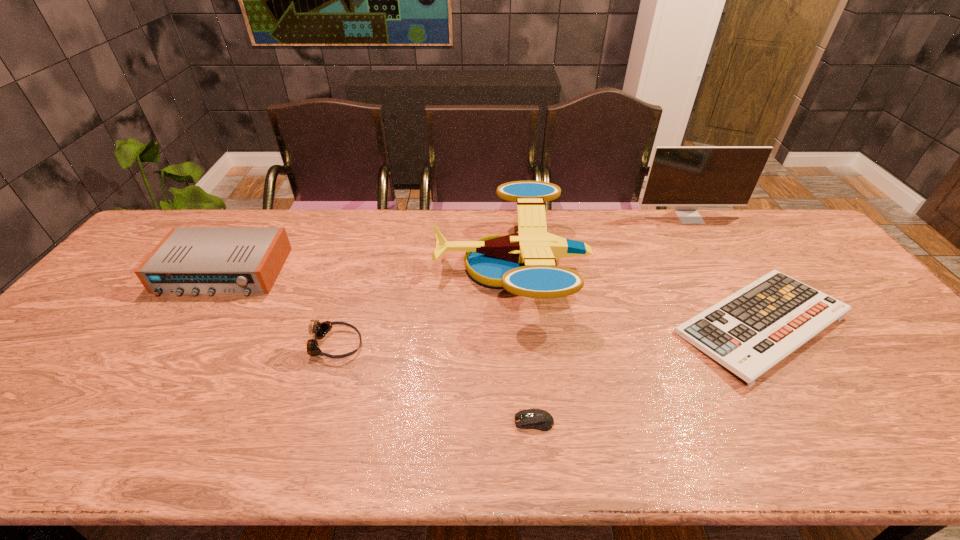
I want to click on monitor, so click(x=686, y=177).

Where is `the fifth shortest object`? This screenshot has height=540, width=960. the fifth shortest object is located at coordinates [x=524, y=263].

This screenshot has height=540, width=960. In order to click on the third tallest object in this screenshot , I will do `click(189, 260)`.

Locate an element on the screen. radio receiver is located at coordinates [x=189, y=260].

Locate an element on the screen. The image size is (960, 540). the third shortest object is located at coordinates (319, 330).

Find the location of a particular element. Image resolution: width=960 pixels, height=540 pixels. goggles is located at coordinates (319, 330).

You are a GUI agent. You are given a task and a screenshot of the screen. Output one action in this format:
    pyautogui.click(x=<x>, y=<y>)
    Task: Click on the computer keyboard
    
    Given the screenshot: What is the action you would take?
    pyautogui.click(x=749, y=332)

Where is `the nearest object`? the nearest object is located at coordinates (538, 419).

Where is `computer equipment`? computer equipment is located at coordinates [x=538, y=419].

I want to click on vacant area situated on the front-facing side of the tallest object, so click(731, 283).